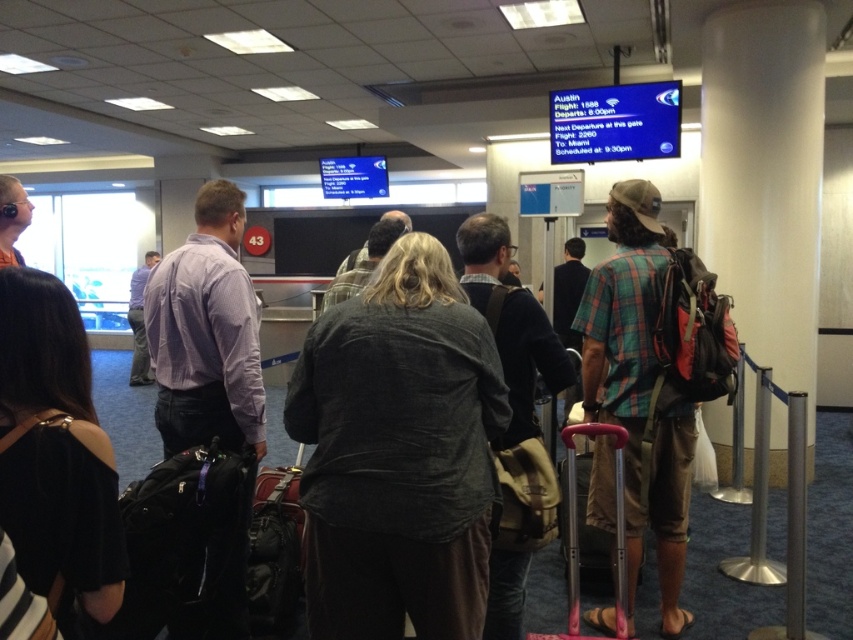
You are a traveler standing in the airport terminal and notice a plaid shirt at center and a leather suitcase at center. Which object is closer to you?

The plaid shirt at center is closer to you because it is further to the viewer than the leather suitcase at center.